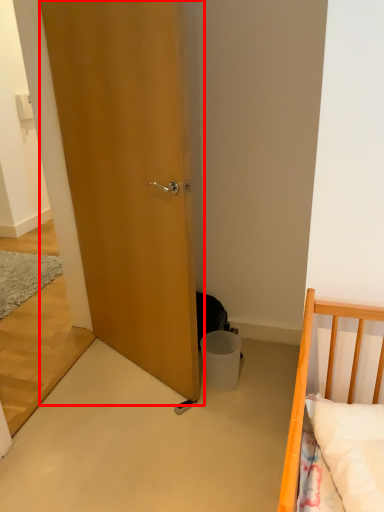
Question: In this image, where is door (annotated by the red box) located relative to trash bin/can?

Choices:
 (A) right
 (B) left

Answer: (B)